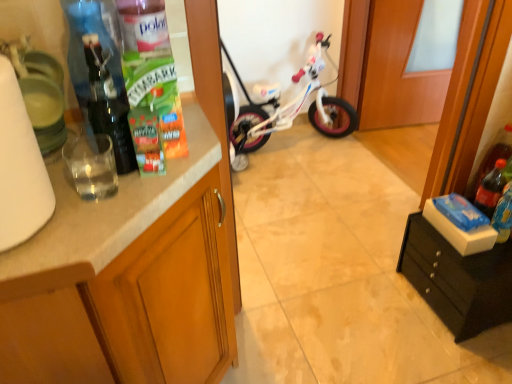
You are a GUI agent. You are given a task and a screenshot of the screen. Output one action in this format:
    pyautogui.click(x=<x>, y=<y>)
    Task: Click on the empty space that is to the right of white matte paper towel at left
    
    Given the screenshot: What is the action you would take?
    pyautogui.click(x=112, y=208)